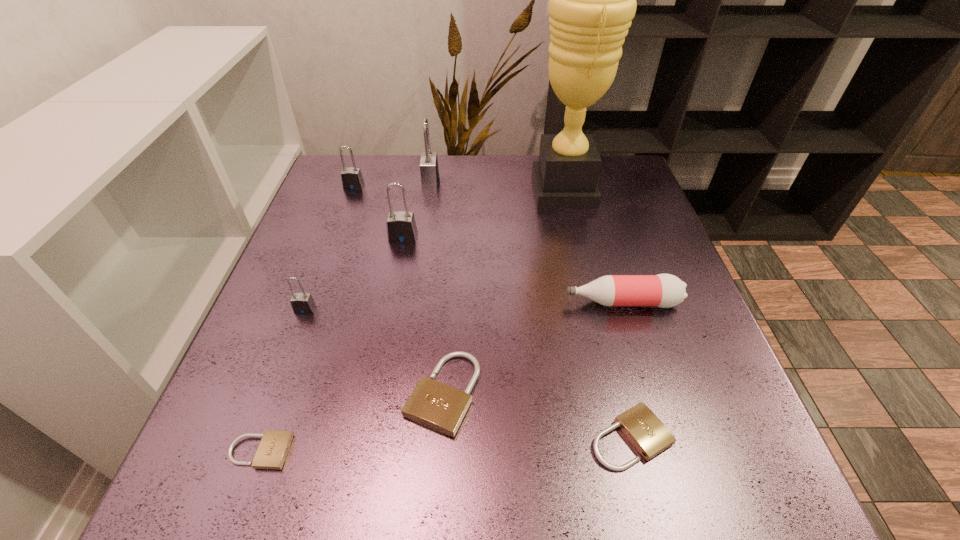
Where is `vacant space at the near edge of the desktop`? vacant space at the near edge of the desktop is located at coordinates (559, 470).

Where is `free point at the left edge`? The width and height of the screenshot is (960, 540). free point at the left edge is located at coordinates coord(348,291).

The width and height of the screenshot is (960, 540). What are the coordinates of `free space at the right edge of the desktop` in the screenshot? It's located at (729, 379).

In the image, there is a desktop. Identify the location of free space at the far left corner. (335, 166).

The height and width of the screenshot is (540, 960). I want to click on free space at the near left corner of the desktop, so 246,489.

Identify the location of free spot at the far right corner of the desktop. The height and width of the screenshot is (540, 960). (606, 186).

Where is `empty space between the fifth shortest padlock and the smallest beige padlock`? Image resolution: width=960 pixels, height=540 pixels. empty space between the fifth shortest padlock and the smallest beige padlock is located at coordinates (306, 319).

The height and width of the screenshot is (540, 960). What are the coordinates of `vacant area that lies between the tallest padlock and the bottle` in the screenshot? It's located at (526, 242).

The image size is (960, 540). I want to click on empty space that is in between the nearest gray padlock and the sixth tallest object, so click(x=464, y=306).

Identify the location of empty space that is in between the third shortest object and the smallest beige padlock. (351, 422).